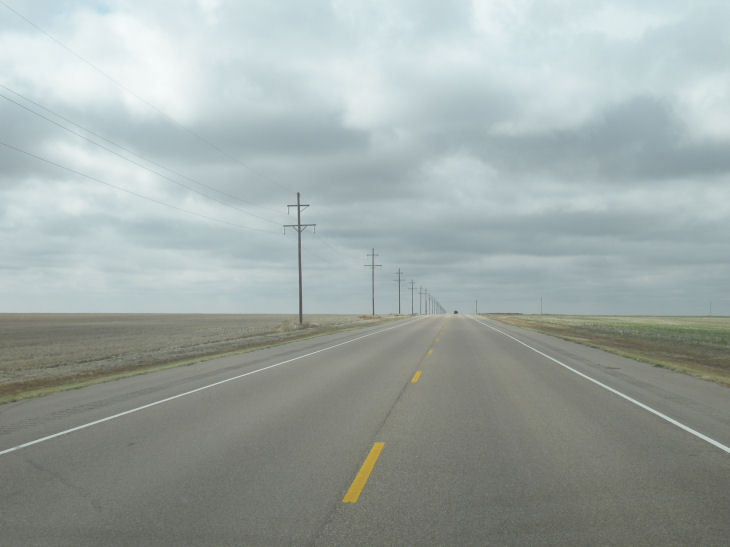
This screenshot has height=547, width=730. What are the coordinates of `cord` in the screenshot? It's located at (139, 155).